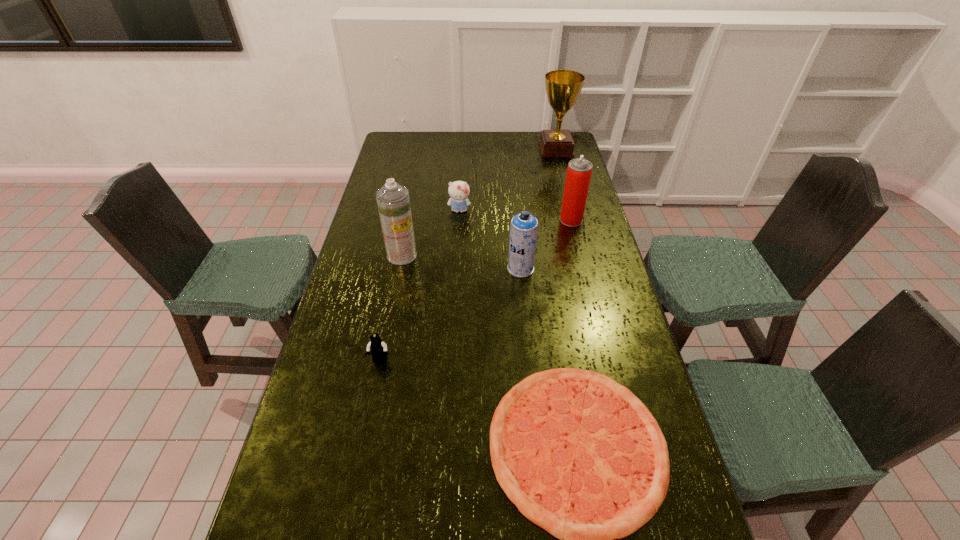
This screenshot has height=540, width=960. Identify the location of award. (563, 87).

Where is `the leftmost aerosol can`? the leftmost aerosol can is located at coordinates pyautogui.click(x=393, y=201).

Where is `the rightmost aerosol can`? The image size is (960, 540). the rightmost aerosol can is located at coordinates (579, 170).

I want to click on the shortest aerosol can, so click(x=524, y=227).

Where is `the second aerosol can from left to right`? The image size is (960, 540). the second aerosol can from left to right is located at coordinates (524, 227).

Locate an element on the screen. Image resolution: width=960 pixels, height=540 pixels. the third object from left to right is located at coordinates (459, 191).

Find the location of a particular element. kitten is located at coordinates (459, 191).

At what (x,y) coordinates should I click in order to perform the action: click on the sixth tallest object. Please return your answer as a coordinate pair (x, y). The image size is (960, 540). Looking at the image, I should click on pyautogui.click(x=378, y=349).

At what (x,y) coordinates should I click in order to perform the action: click on Lego. Please return your answer as a coordinate pair (x, y). Looking at the image, I should click on (378, 349).

At what (x,y) coordinates should I click in order to perform the action: click on free space located 0.130m on the plaque of the award. Please return your answer as a coordinate pair (x, y). This screenshot has width=960, height=540. Looking at the image, I should click on (512, 149).